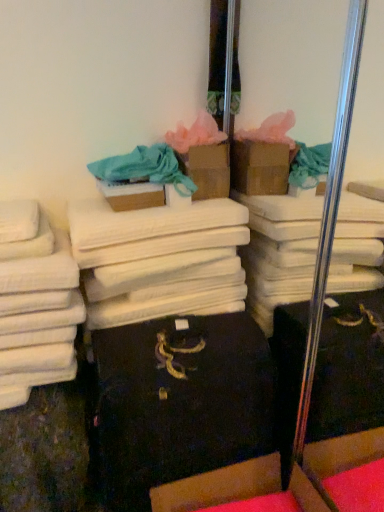
Question: From the image's perspective, is cardboard box at lower center, acting as the first cardboard box starting from the front, on white cotton towels at left?

Choices:
 (A) no
 (B) yes

Answer: (A)

Question: Considering the relative sizes of cardboard box at lower center, acting as the first cardboard box starting from the front, and white cotton towels at left in the image provided, is cardboard box at lower center, acting as the first cardboard box starting from the front, shorter than white cotton towels at left?

Choices:
 (A) yes
 (B) no

Answer: (B)

Question: Does cardboard box at lower center, acting as the first cardboard box starting from the front, have a greater width compared to white cotton towels at left?

Choices:
 (A) yes
 (B) no

Answer: (A)

Question: Does cardboard box at lower center, the first cardboard box ordered from the bottom, have a smaller size compared to white cotton towels at left?

Choices:
 (A) yes
 (B) no

Answer: (B)

Question: Is cardboard box at lower center, the first cardboard box ordered from the bottom, to the right of white cotton towels at left from the viewer's perspective?

Choices:
 (A) no
 (B) yes

Answer: (B)

Question: Based on their sizes in the image, would you say white cotton towels at center is bigger or smaller than cardboard box at center, the 1th cardboard box viewed from the back?

Choices:
 (A) big
 (B) small

Answer: (A)

Question: Is point (170, 288) closer or farther from the camera than point (185, 164)?

Choices:
 (A) closer
 (B) farther

Answer: (A)

Question: Is white cotton towels at center inside or outside of cardboard box at center, the 1th cardboard box viewed from the back?

Choices:
 (A) outside
 (B) inside

Answer: (A)

Question: Is white cotton towels at center wider or thinner than cardboard box at center, the 1th cardboard box viewed from the top?

Choices:
 (A) wide
 (B) thin

Answer: (A)

Question: Is matte blue fabric at upper center spatially inside white cotton towels at center, or outside of it?

Choices:
 (A) outside
 (B) inside

Answer: (A)

Question: Is matte blue fabric at upper center in front of or behind white cotton towels at center in the image?

Choices:
 (A) front
 (B) behind

Answer: (B)

Question: Based on their positions, is matte blue fabric at upper center located to the left or right of white cotton towels at center?

Choices:
 (A) left
 (B) right

Answer: (A)

Question: Looking at their shapes, would you say matte blue fabric at upper center is wider or thinner than white cotton towels at center?

Choices:
 (A) thin
 (B) wide

Answer: (A)

Question: Is cardboard box at lower center, the first cardboard box ordered from the bottom, in front of or behind cardboard box at center, which is counted as the 3th cardboard box, starting from the front, in the image?

Choices:
 (A) behind
 (B) front

Answer: (B)

Question: From the image's perspective, is cardboard box at lower center, the first cardboard box ordered from the bottom, located above or below cardboard box at center, the 1th cardboard box viewed from the back?

Choices:
 (A) below
 (B) above

Answer: (A)